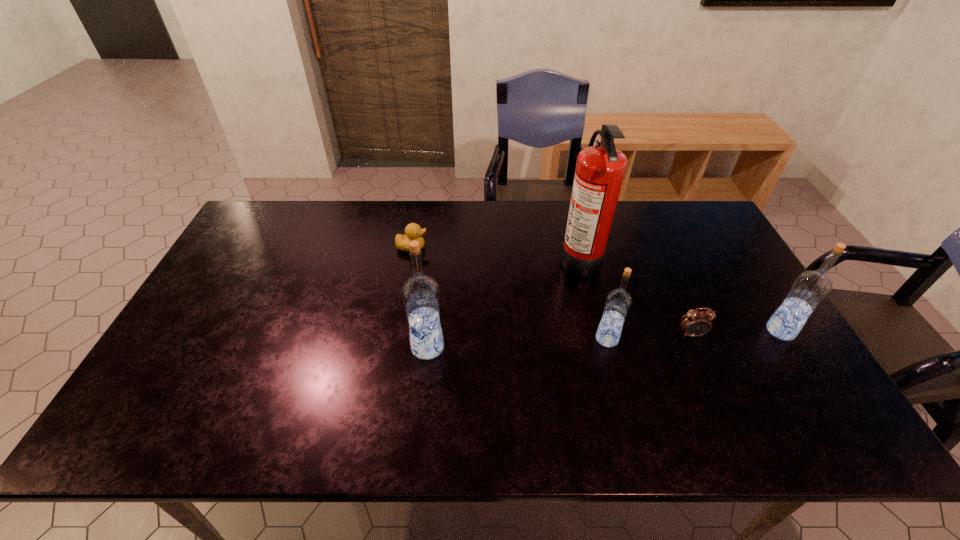
In the image, there is a desktop. Where is `vacant space at the near edge`? The image size is (960, 540). vacant space at the near edge is located at coordinates (285, 394).

Image resolution: width=960 pixels, height=540 pixels. In the image, there is a desktop. Find the location of `free space at the left edge`. free space at the left edge is located at coordinates (245, 246).

Identify the location of free space at the right edge of the desktop. (768, 343).

Where is `vacant space at the far left corner`? The image size is (960, 540). vacant space at the far left corner is located at coordinates (256, 212).

Find the location of a particular element. free spot between the alarm clock and the duckling is located at coordinates [x=552, y=291].

This screenshot has height=540, width=960. I want to click on free space between the tallest object and the second vodka from left to right, so click(x=593, y=298).

Locate an element on the screen. The image size is (960, 540). empty space that is in between the leftmost vodka and the second object from right to left is located at coordinates (560, 341).

This screenshot has height=540, width=960. In order to click on free space between the second object from right to left and the second vodka from left to right in this screenshot , I will do `click(649, 336)`.

Locate an element on the screen. vacant space that is in between the duckling and the rightmost object is located at coordinates (596, 289).

Locate an element on the screen. vacant area that lies between the fifth object from left to right and the leftmost vodka is located at coordinates (560, 341).